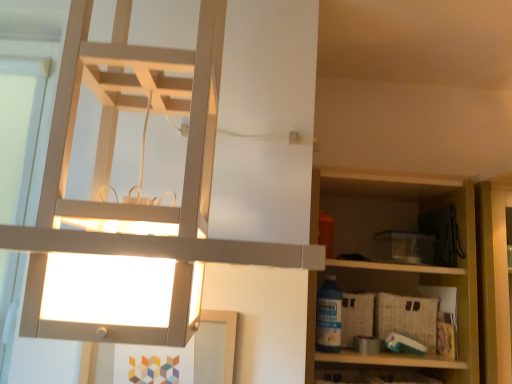
What do you see at coordinates (396, 264) in the screenshot? I see `wooden shelf at right` at bounding box center [396, 264].

The width and height of the screenshot is (512, 384). I want to click on blue plastic bottle at lower right, so click(328, 316).

The width and height of the screenshot is (512, 384). In order to click on matte white lamp at upper left in this screenshot , I will do `click(126, 204)`.

In order to click on woven beige crate at lower right in this screenshot , I will do `click(407, 318)`.

Identify the location of wooden shelf at right. The width and height of the screenshot is (512, 384). (396, 264).

Visually, is matte white lamp at upper left positioned to the left or to the right of woven beige crate at lower right?

Clearly, matte white lamp at upper left is on the left of woven beige crate at lower right in the image.

Is matte white lamp at upper left spatially inside woven beige crate at lower right, or outside of it?

matte white lamp at upper left is outside woven beige crate at lower right.

Based on their sizes in the image, would you say matte white lamp at upper left is bigger or smaller than woven beige crate at lower right?

Considering their sizes, matte white lamp at upper left takes up more space than woven beige crate at lower right.

Which is closer to the camera, [330,335] or [425,337]?

Point [330,335]

Visually, is blue plastic bottle at lower right positioned to the left or to the right of woven beige crate at lower right?

blue plastic bottle at lower right is to the left of woven beige crate at lower right.

In the scene shown: Is blue plastic bottle at lower right inside the boundaries of woven beige crate at lower right, or outside?

blue plastic bottle at lower right is not enclosed by woven beige crate at lower right.

Considering the sizes of objects blue plastic bottle at lower right and woven beige crate at lower right in the image provided, who is shorter, blue plastic bottle at lower right or woven beige crate at lower right?

woven beige crate at lower right is shorter.

Is woven beige crate at lower right to the left of blue plastic bottle at lower right from the viewer's perspective?

No.

Can you see woven beige crate at lower right touching blue plastic bottle at lower right?

woven beige crate at lower right and blue plastic bottle at lower right are not in contact.

From a real-world perspective, is woven beige crate at lower right positioned above or below blue plastic bottle at lower right?

woven beige crate at lower right is below blue plastic bottle at lower right.

Which is correct: woven beige crate at lower right is inside blue plastic bottle at lower right, or outside of it?

woven beige crate at lower right cannot be found inside blue plastic bottle at lower right.

Which object is positioned more to the left, blue plastic bottle at lower right or wooden shelf at right?

blue plastic bottle at lower right.

From the image's perspective, is blue plastic bottle at lower right below wooden shelf at right?

Yes, from the image's perspective, blue plastic bottle at lower right is beneath wooden shelf at right.

Is blue plastic bottle at lower right far away from wooden shelf at right?

blue plastic bottle at lower right is near wooden shelf at right, not far away.

How many degrees apart are the facing directions of blue plastic bottle at lower right and wooden shelf at right?

The facing directions of blue plastic bottle at lower right and wooden shelf at right are 4.71 degrees apart.

Is wooden shelf at right at the left side of woven beige crate at lower right?

Yes, wooden shelf at right is to the left of woven beige crate at lower right.

From a real-world perspective, is wooden shelf at right over woven beige crate at lower right?

Indeed, from a real-world perspective, wooden shelf at right stands above woven beige crate at lower right.

Is wooden shelf at right inside or outside of woven beige crate at lower right?

wooden shelf at right exists outside the volume of woven beige crate at lower right.

Which point is more forward, [308,323] or [428,348]?

The point [308,323] is closer.

Could you tell me if woven beige crate at lower right is facing wooden shelf at right?

Yes, woven beige crate at lower right is oriented towards wooden shelf at right.

From the image's perspective, is woven beige crate at lower right over wooden shelf at right?

No, from the image's perspective, woven beige crate at lower right is not over wooden shelf at right.

Is point (390, 323) positioned before point (381, 193)?

Yes.

In terms of width, does matte white lamp at upper left look wider or thinner when compared to wooden shelf at right?

In the image, matte white lamp at upper left appears to be wider than wooden shelf at right.

From a real-world perspective, which object rests below the other?

wooden shelf at right, from a real-world perspective.

Where is `lamp above the wooden shelf at right (from a real-world perspective)`? The height and width of the screenshot is (384, 512). lamp above the wooden shelf at right (from a real-world perspective) is located at coordinates (126, 204).

This screenshot has width=512, height=384. I want to click on lamp located above the woven beige crate at lower right (from the image's perspective), so click(126, 204).

Locate an element on the screen. This screenshot has width=512, height=384. crate that appears below the blue plastic bottle at lower right (from a real-world perspective) is located at coordinates (407, 318).

Looking at this image, based on their spatial positions, is blue plastic bottle at lower right or woven beige crate at lower right further from matte white lamp at upper left?

woven beige crate at lower right.

Based on their spatial positions, is blue plastic bottle at lower right or wooden shelf at right further from matte white lamp at upper left?

blue plastic bottle at lower right lies further to matte white lamp at upper left than the other object.

Looking at this image, based on their spatial positions, is blue plastic bottle at lower right or wooden shelf at right closer to woven beige crate at lower right?

blue plastic bottle at lower right is closer to woven beige crate at lower right.

Looking at the image, which one is located further to wooden shelf at right, blue plastic bottle at lower right or woven beige crate at lower right?

blue plastic bottle at lower right.

Estimate the real-world distances between objects in this image. Which object is closer to blue plastic bottle at lower right, wooden shelf at right or matte white lamp at upper left?

wooden shelf at right lies closer to blue plastic bottle at lower right than the other object.

From the image, which object appears to be farther from blue plastic bottle at lower right, woven beige crate at lower right or wooden shelf at right?

wooden shelf at right.

From the image, which object appears to be farther from wooden shelf at right, matte white lamp at upper left or woven beige crate at lower right?

Among the two, matte white lamp at upper left is located further to wooden shelf at right.

Looking at the image, which one is located further to woven beige crate at lower right, wooden shelf at right or matte white lamp at upper left?

matte white lamp at upper left is positioned further to the anchor woven beige crate at lower right.

Locate an element on the screen. The image size is (512, 384). shelf between matte white lamp at upper left and blue plastic bottle at lower right in the front-back direction is located at coordinates (396, 264).

At what (x,y) coordinates should I click in order to perform the action: click on bottle positioned between matte white lamp at upper left and woven beige crate at lower right from near to far. Please return your answer as a coordinate pair (x, y). The image size is (512, 384). Looking at the image, I should click on (328, 316).

You are a GUI agent. You are given a task and a screenshot of the screen. Output one action in this format:
    pyautogui.click(x=<x>, y=<y>)
    Task: Click on the shelf between blue plastic bottle at lower right and woven beige crate at lower right
    
    Given the screenshot: What is the action you would take?
    pyautogui.click(x=396, y=264)

At what (x,y) coordinates should I click in order to perform the action: click on shelf positioned between matte white lamp at upper left and woven beige crate at lower right from near to far. Please return your answer as a coordinate pair (x, y). Image resolution: width=512 pixels, height=384 pixels. Looking at the image, I should click on (396, 264).